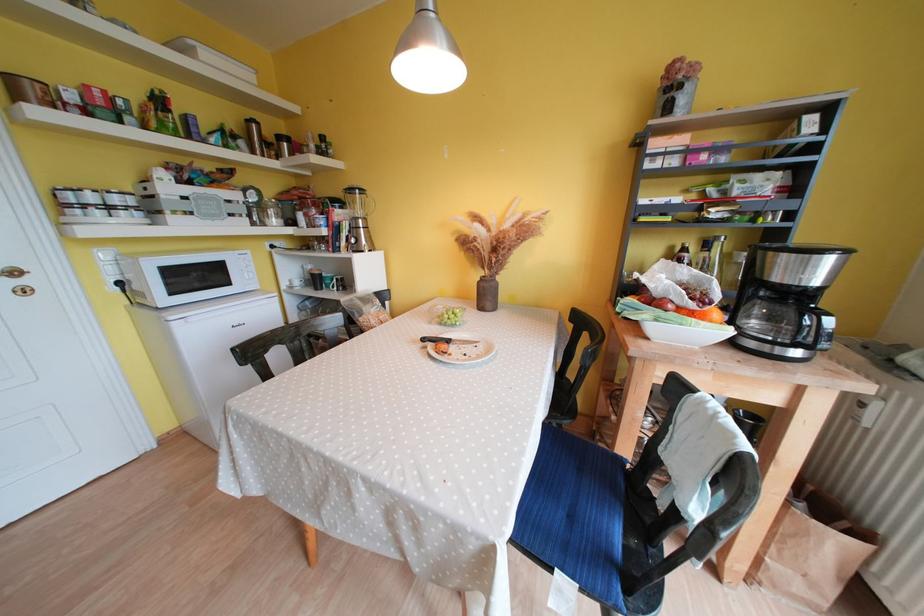
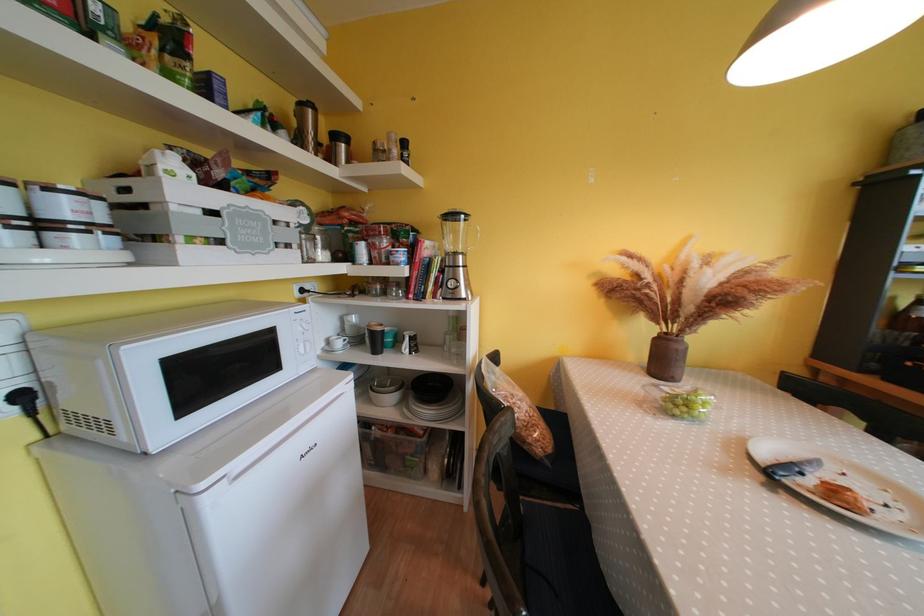
What movement of the cameraman would produce the second image?

The cameraman moved toward left, forward.